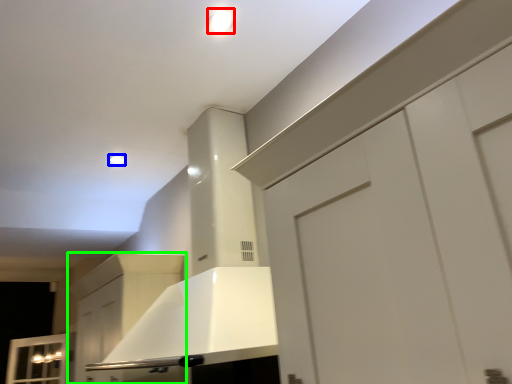
Question: Which object is the farthest from lighting (highlighted by a red box)? Choose among these: lighting (highlighted by a blue box) or cabinetry (highlighted by a green box).

Choices:
 (A) lighting
 (B) cabinetry

Answer: (B)